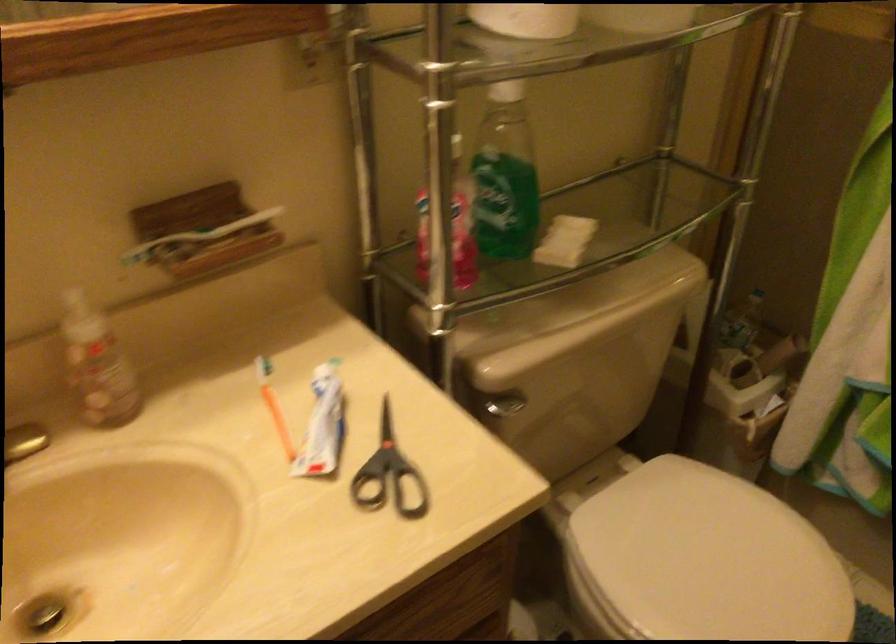
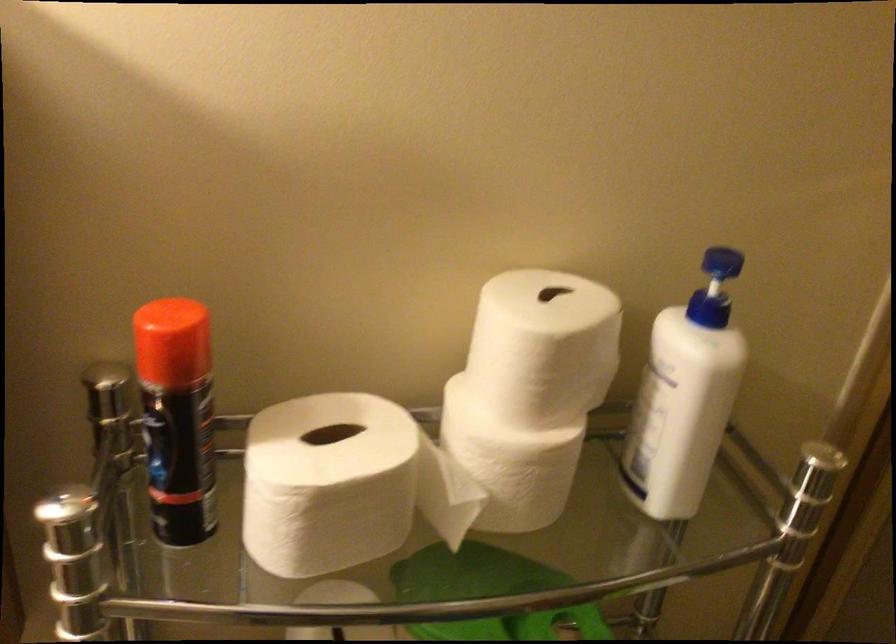
Question: The camera is either moving clockwise (left) or counter-clockwise (right) around the object. The first image is from the beginning of the video and the second image is from the end. Is the camera moving left or right when shooting the video?

Choices:
 (A) Left
 (B) Right

Answer: (B)